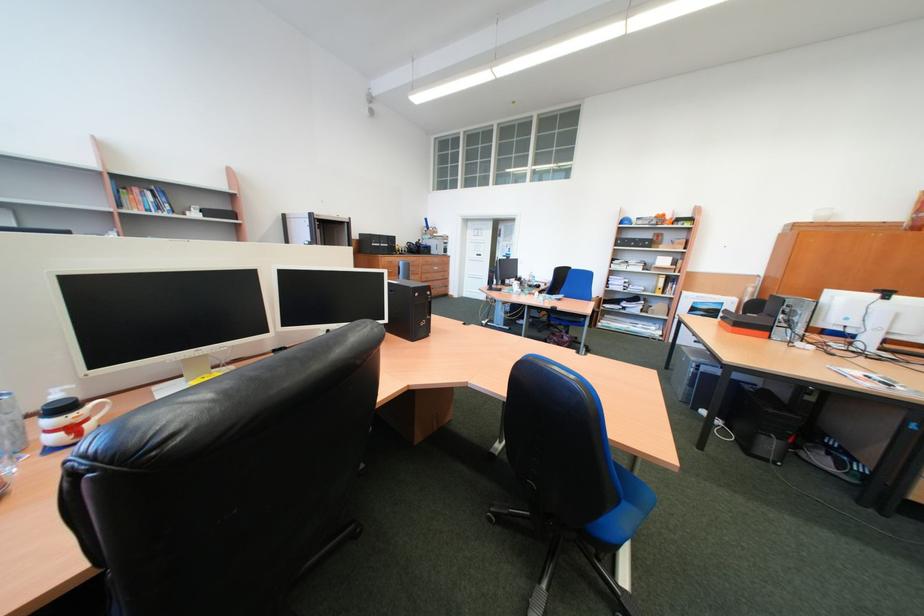
The image size is (924, 616). Identify the location of blue chair sitting surface. (626, 517).